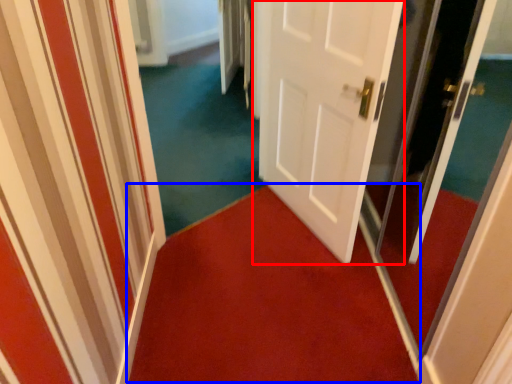
Question: Which object appears closest to the camera in this image, door (highlighted by a red box) or doormat (highlighted by a blue box)?

Choices:
 (A) door
 (B) doormat

Answer: (A)